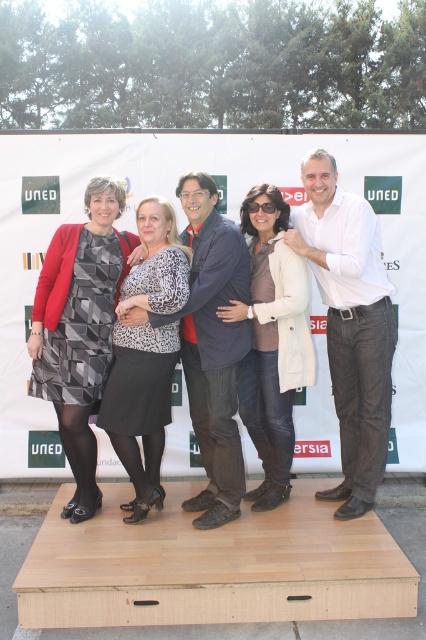
Question: Which object is the closest to the white matte jacket at center?

Choices:
 (A) matte black dress at center
 (B) white cotton shirt at center

Answer: (B)

Question: Does white cotton shirt at center appear under matte black dress at center?

Choices:
 (A) yes
 (B) no

Answer: (B)

Question: Which point is farther to the camera?

Choices:
 (A) (267, 358)
 (B) (58, 273)
 (C) (356, 376)

Answer: (C)

Question: Does white cotton shirt at center have a smaller size compared to matte black dress at center?

Choices:
 (A) no
 (B) yes

Answer: (A)

Question: Which of these objects is positioned closest to the white matte jacket at center?

Choices:
 (A) white cotton shirt at center
 (B) matte black dress at center

Answer: (A)

Question: Does white cotton shirt at center lie behind matte black dress at center?

Choices:
 (A) no
 (B) yes

Answer: (A)